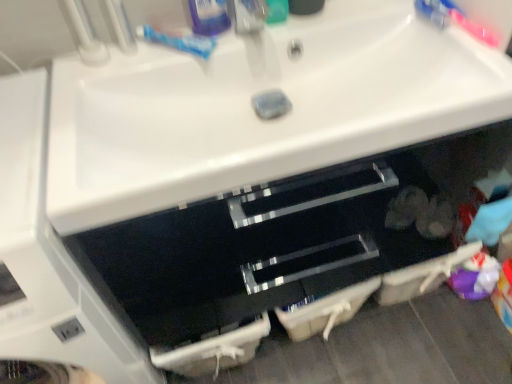
Question: From a real-world perspective, is pink plastic toothbrush at upper right positioned above or below blue matte toothpaste at upper center?

Choices:
 (A) below
 (B) above

Answer: (A)

Question: Would you say pink plastic toothbrush at upper right is to the left or to the right of blue matte toothpaste at upper center in the picture?

Choices:
 (A) right
 (B) left

Answer: (A)

Question: Which object is positioned closest to the green plastic toothpaste tube at upper center, the 1th toiletry in the right-to-left sequence?

Choices:
 (A) pink plastic toothbrush at upper right
 (B) matte plastic faucet at upper center
 (C) blue glossy toothpaste tube at upper center, marked as the second toiletry in a right-to-left arrangement
 (D) white glossy sink at center
 (E) blue matte toothpaste at upper center

Answer: (B)

Question: Based on their relative distances, which object is farther from the matte plastic faucet at upper center?

Choices:
 (A) pink plastic toothbrush at upper right
 (B) blue matte toothpaste at upper center
 (C) green plastic toothpaste tube at upper center, the 1th toiletry in the right-to-left sequence
 (D) white glossy sink at center
 (E) blue glossy toothpaste tube at upper center, the 1th toiletry when ordered from left to right

Answer: (A)